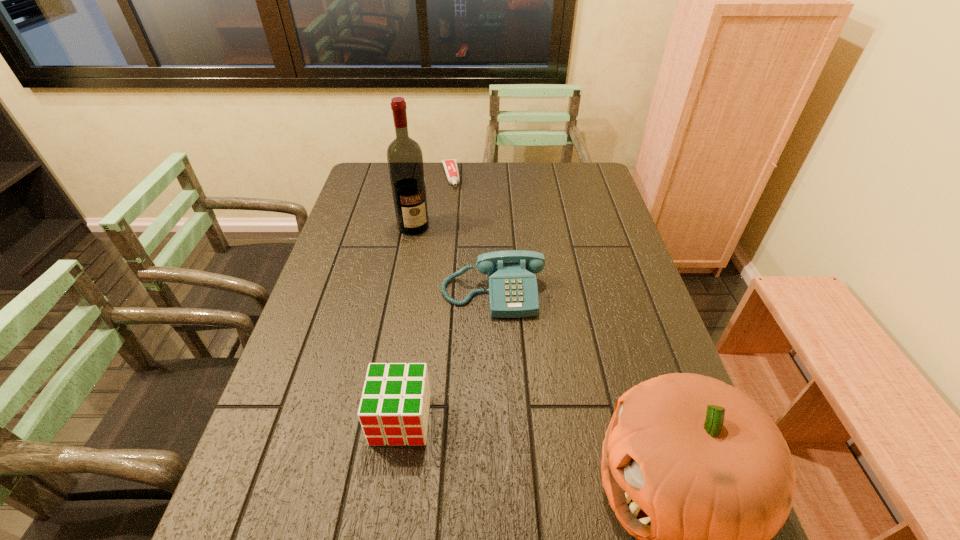
Where is `free space on the desktop that is between the cube and the rightmost object and is positioned at the nozzle of the shortest object`? free space on the desktop that is between the cube and the rightmost object and is positioned at the nozzle of the shortest object is located at coordinates (513, 446).

In order to click on vacant space on the desktop that is between the cube and the rightmost object and is positioned on the front and back of the tallest object in this screenshot , I will do `click(524, 449)`.

You are a GUI agent. You are given a task and a screenshot of the screen. Output one action in this format:
    pyautogui.click(x=<x>, y=<y>)
    Task: Click on the free space on the desktop that is between the cube and the fourth shortest object and is positioned on the dial of the telephone
    This screenshot has height=540, width=960.
    Given the screenshot: What is the action you would take?
    pyautogui.click(x=506, y=444)